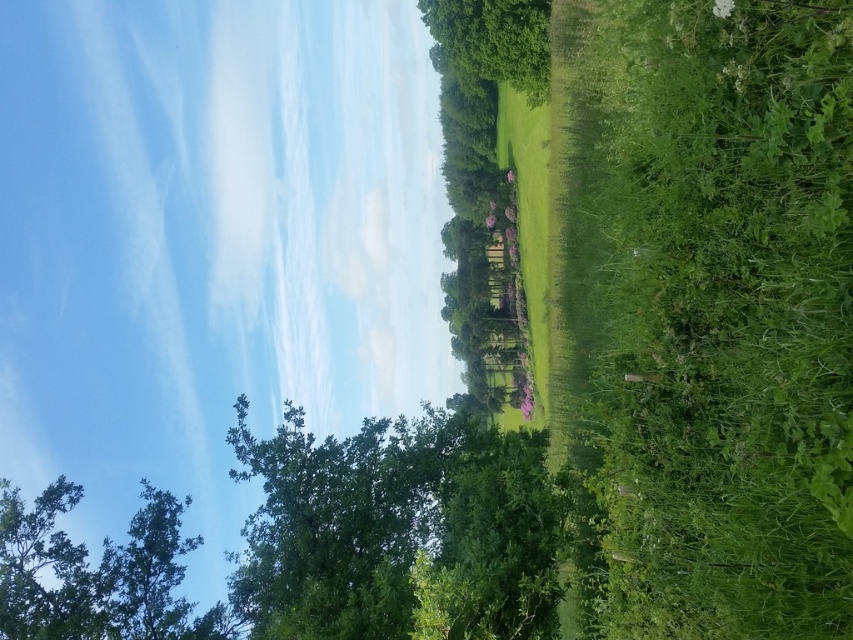
Between point (694, 260) and point (9, 593), which one is positioned in front?

Positioned in front is point (694, 260).

Which of these two, green leafy tree at right or green leafy tree at lower left, stands taller?

green leafy tree at right

Is point (798, 561) in front of point (114, 618)?

Yes, it is in front of point (114, 618).

This screenshot has width=853, height=640. I want to click on green leafy tree at right, so click(714, 308).

Does point (369, 492) come closer to viewer compared to point (28, 604)?

That is False.

Find the location of a particular element. green leafy tree at center is located at coordinates point(337,524).

Find the location of a particular element. The width and height of the screenshot is (853, 640). green leafy tree at center is located at coordinates (337, 524).

Which is above, green leafy tree at right or green leafy tree at upper center?

green leafy tree at upper center

Is point (676, 604) behind point (445, 38)?

No.

Locate an element on the screen. green leafy tree at right is located at coordinates (714, 308).